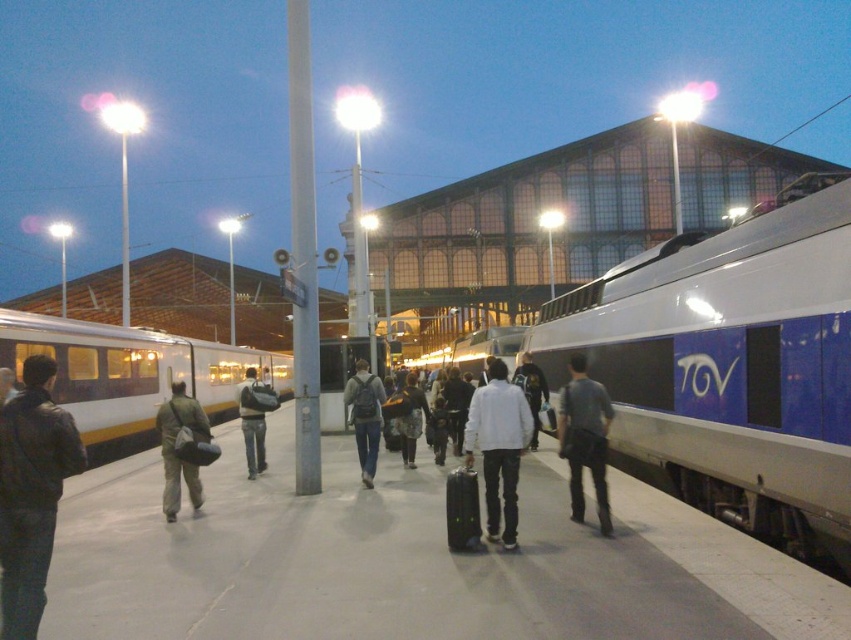
Can you confirm if silver metallic train at center is taller than denim jacket at center?

Yes, silver metallic train at center is taller than denim jacket at center.

Which is above, silver metallic train at center or denim jacket at center?

silver metallic train at center is above.

Does point (420, 369) come behind point (244, 426)?

Yes, point (420, 369) is farther from viewer.

Where is `silver metallic train at center`? The image size is (851, 640). silver metallic train at center is located at coordinates (475, 349).

Does leather jacket at left appear on the left side of gray fabric bag at center?

Yes, leather jacket at left is to the left of gray fabric bag at center.

At what (x,y) coordinates should I click in order to perform the action: click on leather jacket at left. Please return your answer as a coordinate pair (x, y). Image resolution: width=851 pixels, height=640 pixels. Looking at the image, I should click on (31, 492).

Looking at this image, is denim backpack at center positioned in front of denim jacket at center?

That is True.

Who is more forward, (x=357, y=381) or (x=266, y=387)?

Positioned in front is point (x=357, y=381).

Where is `denim backpack at center`? This screenshot has height=640, width=851. denim backpack at center is located at coordinates (364, 417).

Locate an element on the screen. denim backpack at center is located at coordinates (364, 417).